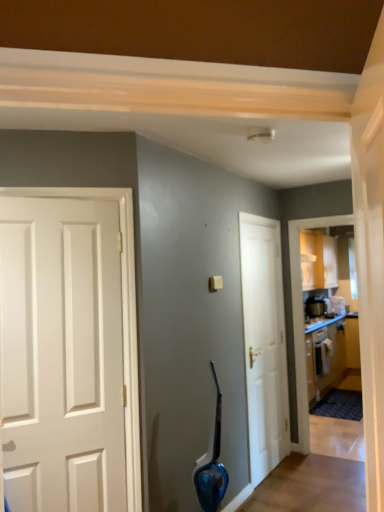
This screenshot has height=512, width=384. I want to click on blank space situated above white glossy door at center (from a real-world perspective), so pyautogui.click(x=261, y=223).